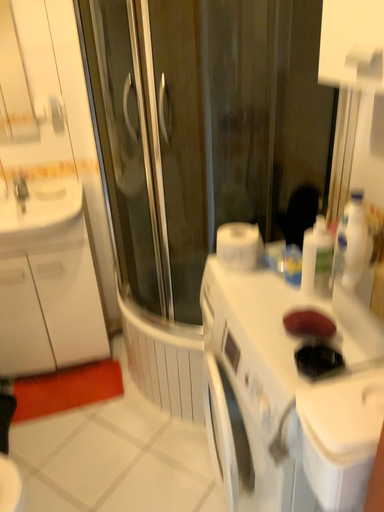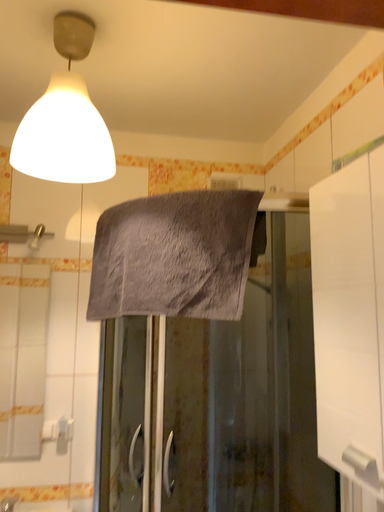
Question: How did the camera likely rotate when shooting the video?

Choices:
 (A) rotated downward
 (B) rotated upward

Answer: (B)